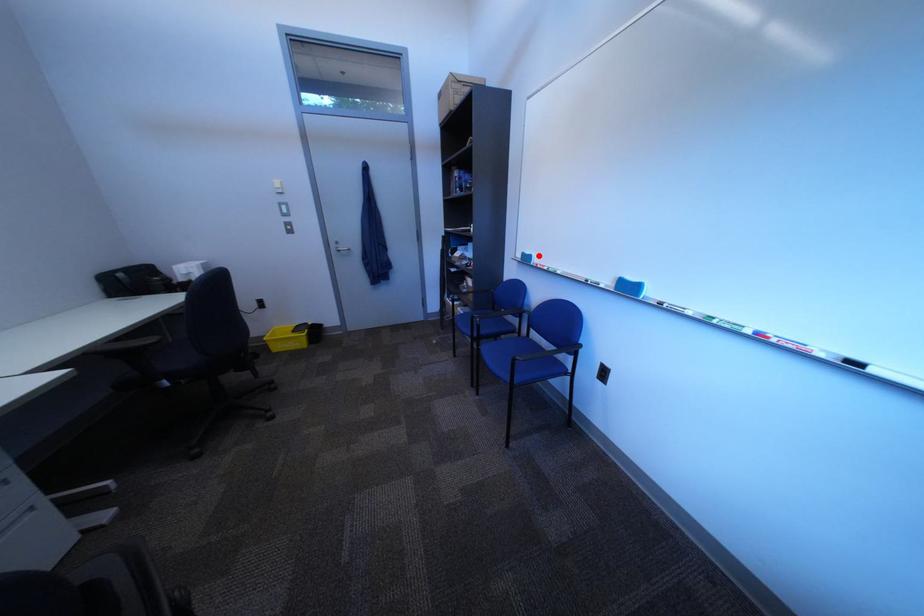
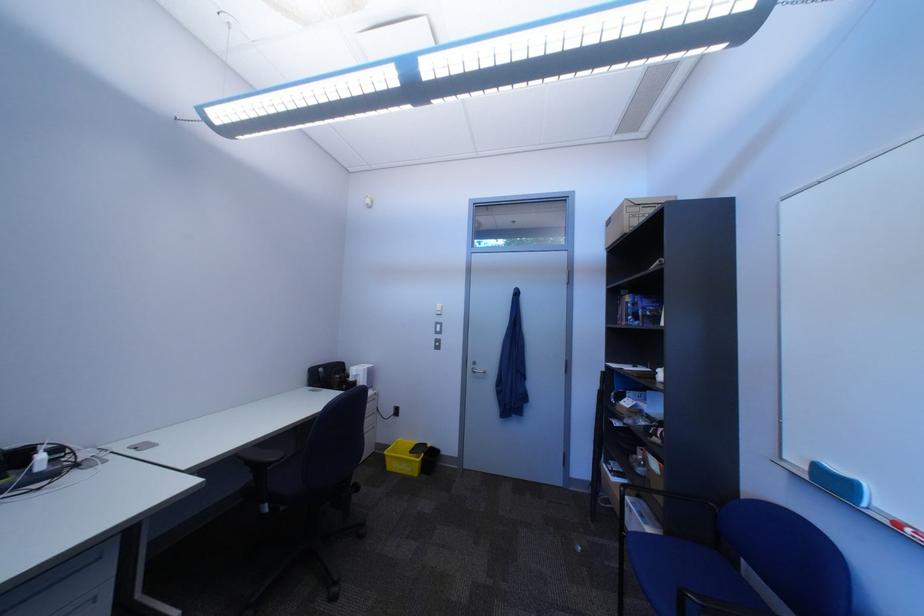
Where in the second image is the point corresponding to the highlighted location from the first image?

(833, 468)